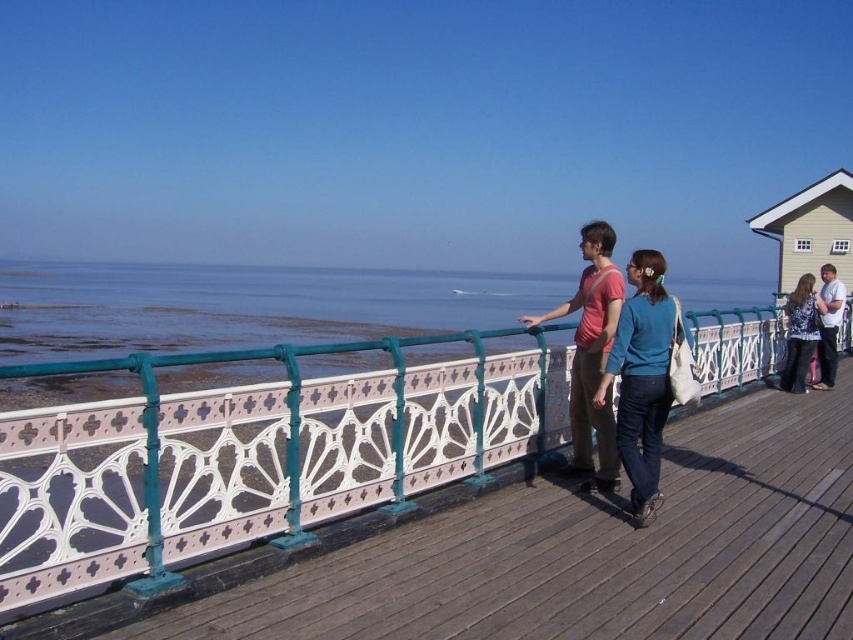
Is teal fabric sweater at center taller than matte pink shirt at center?

No.

Based on the photo, is teal fabric sweater at center thinner than matte pink shirt at center?

Indeed, teal fabric sweater at center has a lesser width compared to matte pink shirt at center.

This screenshot has width=853, height=640. Describe the element at coordinates (642, 378) in the screenshot. I see `teal fabric sweater at center` at that location.

The image size is (853, 640). What are the coordinates of `teal fabric sweater at center` in the screenshot? It's located at (642, 378).

Does white painted wood dock at center have a lesser width compared to teal fabric sweater at center?

Yes.

Who is more forward, (225, 525) or (640, 483)?

Point (225, 525) is more forward.

Between point (137, 570) and point (634, 314), which one is positioned behind?

The point (634, 314) is more distant.

What are the coordinates of `white painted wood dock at center` in the screenshot? It's located at (250, 470).

Who is positioned more to the right, white painted wood dock at center or light brown leather jacket at right?

light brown leather jacket at right is more to the right.

Is white painted wood dock at center to the right of light brown leather jacket at right from the viewer's perspective?

No, white painted wood dock at center is not to the right of light brown leather jacket at right.

What do you see at coordinates (250, 470) in the screenshot? The image size is (853, 640). I see `white painted wood dock at center` at bounding box center [250, 470].

Locate an element on the screen. white painted wood dock at center is located at coordinates (250, 470).